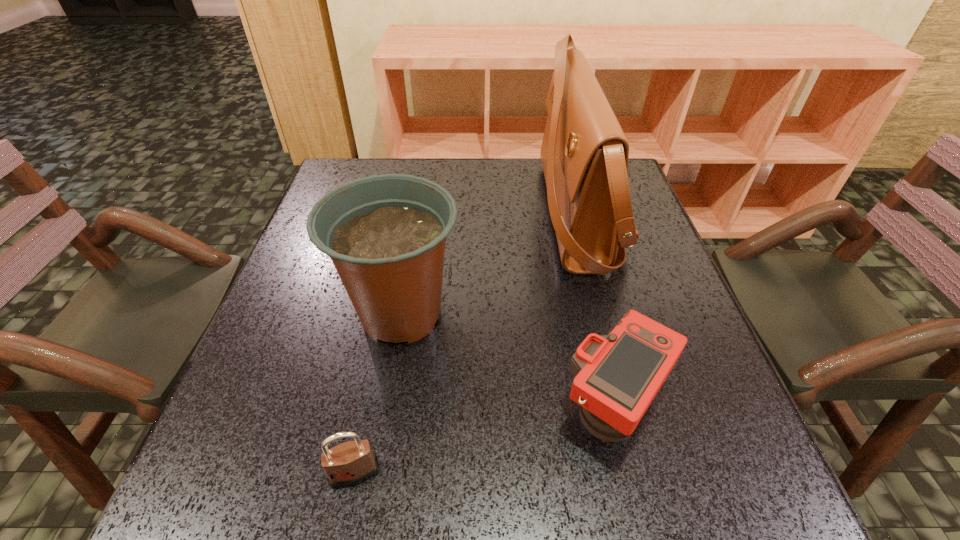
I want to click on object present at the far edge, so click(x=584, y=153).

Locate an element on the screen. The height and width of the screenshot is (540, 960). camera situated at the near edge is located at coordinates (617, 376).

The width and height of the screenshot is (960, 540). I want to click on padlock that is positioned at the near edge, so (350, 463).

Identify the location of object present at the left edge. This screenshot has width=960, height=540. (385, 234).

You are a GUI agent. You are given a task and a screenshot of the screen. Output one action in this format:
    pyautogui.click(x=<x>, y=<y>)
    Task: Click on the satchel located at the right edge
    
    Given the screenshot: What is the action you would take?
    pyautogui.click(x=584, y=153)

Where is `camera situated at the right edge`? This screenshot has width=960, height=540. camera situated at the right edge is located at coordinates (617, 376).

What are the coordinates of `object positioned at the far right corner` in the screenshot? It's located at (584, 153).

The width and height of the screenshot is (960, 540). In order to click on object situated at the near right corner in this screenshot , I will do (x=617, y=376).

Identify the location of vacant space at the far edge. Image resolution: width=960 pixels, height=540 pixels. (469, 158).

In the image, there is a desktop. Identify the location of vacant space at the near edge. (621, 497).